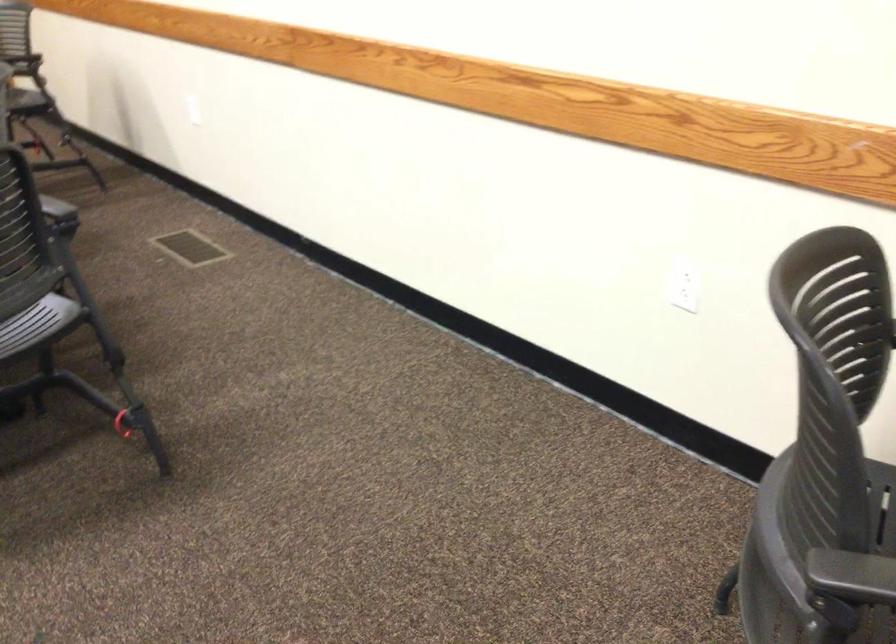
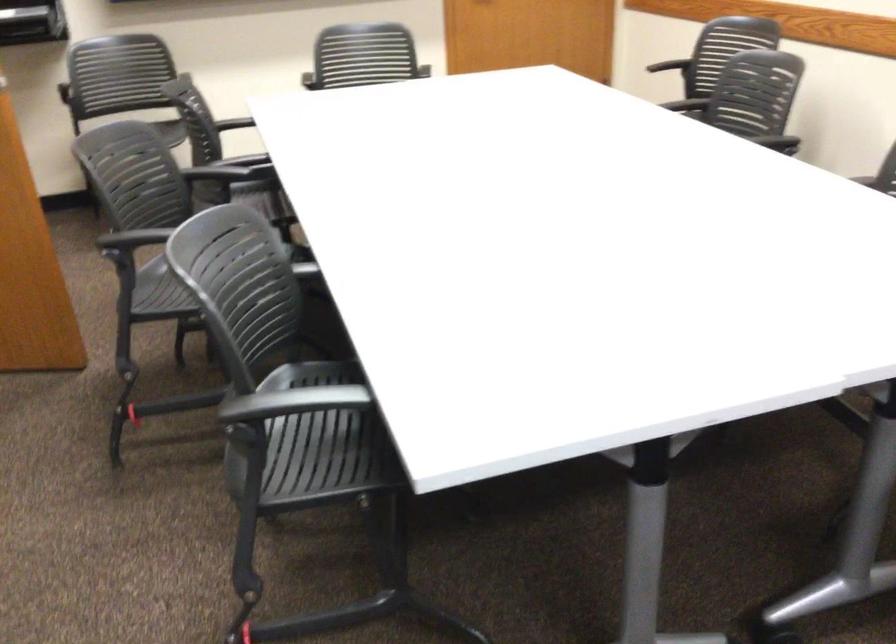
Question: The images are taken continuously from a first-person perspective. In which direction are you moving?

Choices:
 (A) Left
 (B) Right
 (C) Forward
 (D) Backward

Answer: (A)